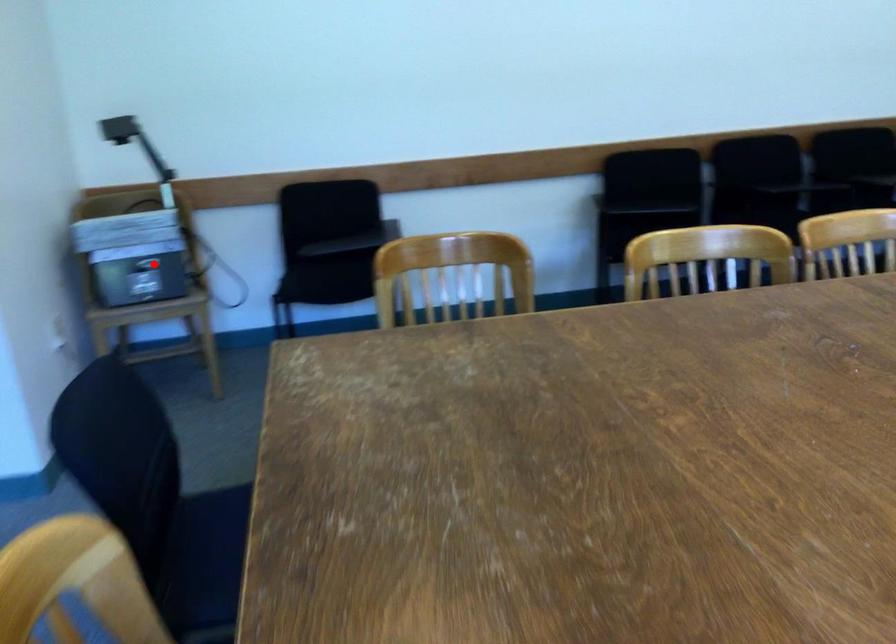
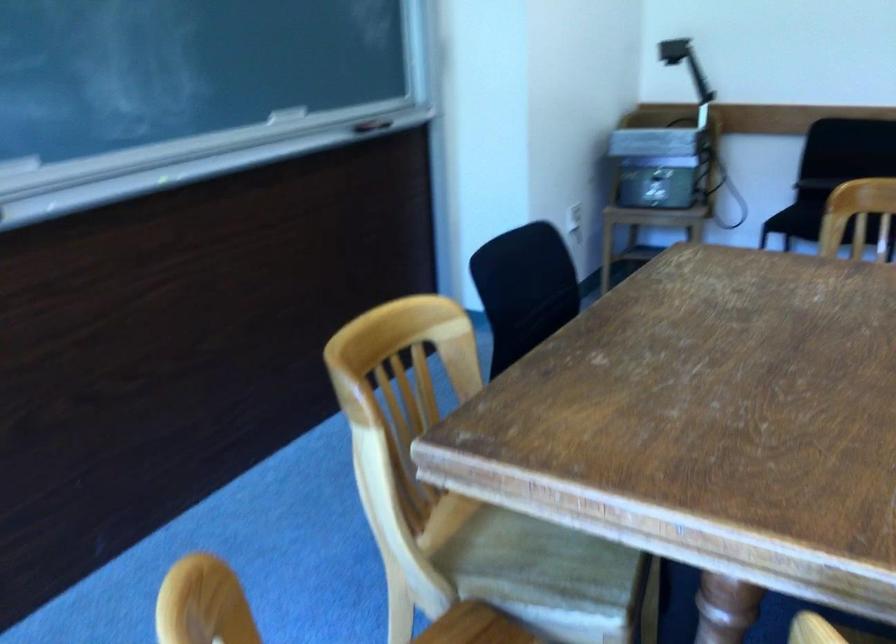
The point at the highlighted location is marked in the first image. Where is the corresponding point in the second image?

(659, 166)